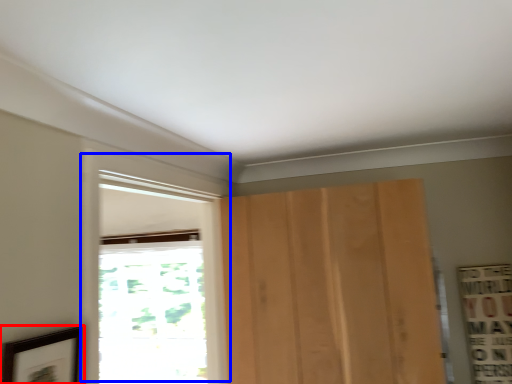
Question: Which object is further to the camera taking this photo, picture frame (highlighted by a red box) or window (highlighted by a blue box)?

Choices:
 (A) picture frame
 (B) window

Answer: (B)